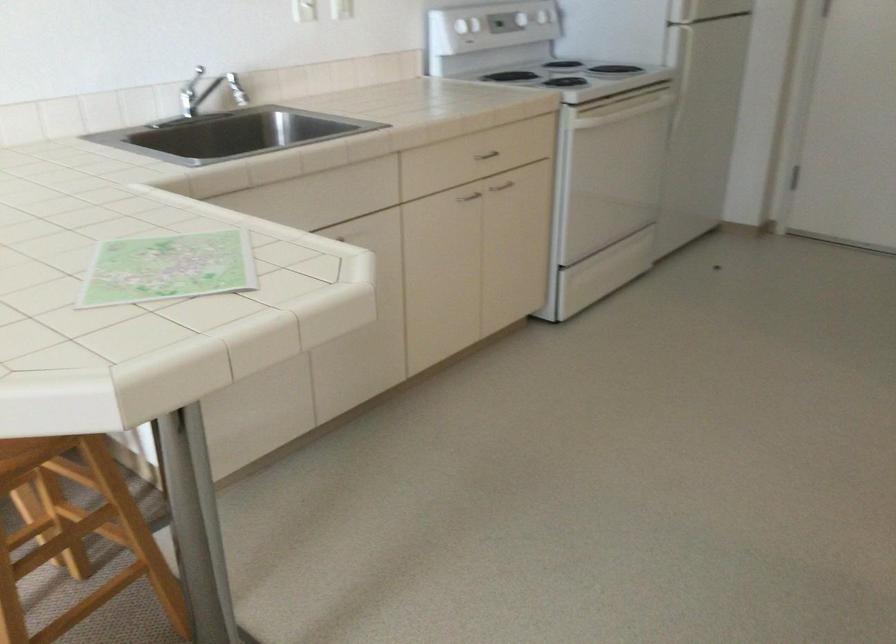
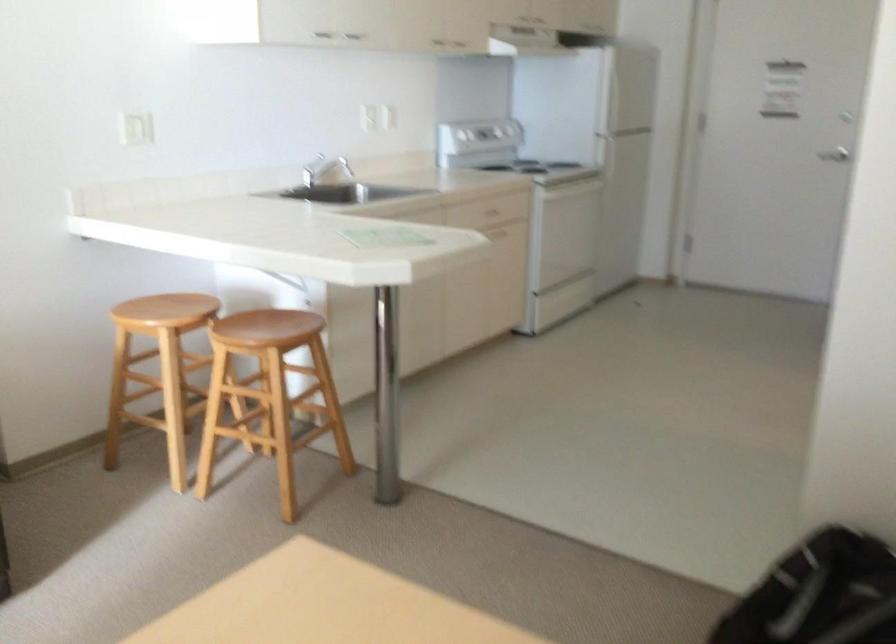
The point at (666, 86) is marked in the first image. Where is the corresponding point in the second image?

(606, 164)